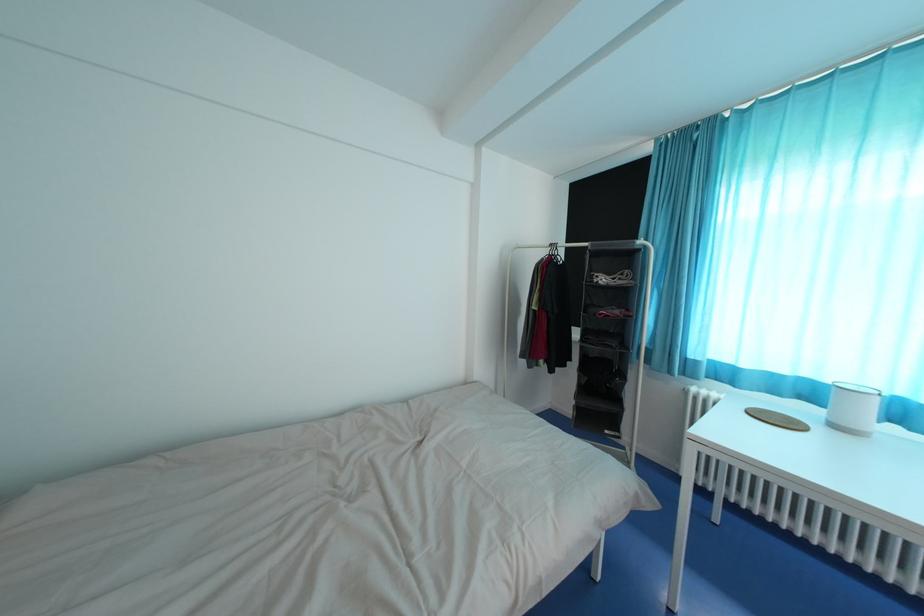
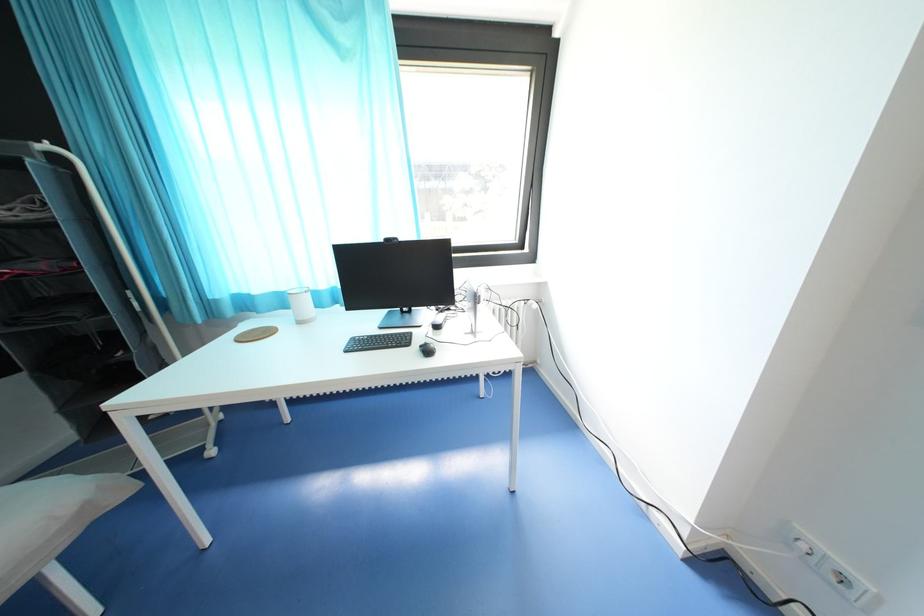
How did the camera likely rotate?

The rotation direction of the camera is right-down.